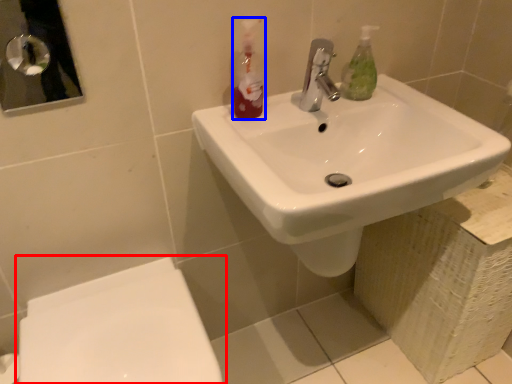
Question: Which point is further to the camera, toilet (highlighted by a red box) or cleaning product (highlighted by a blue box)?

Choices:
 (A) toilet
 (B) cleaning product

Answer: (B)